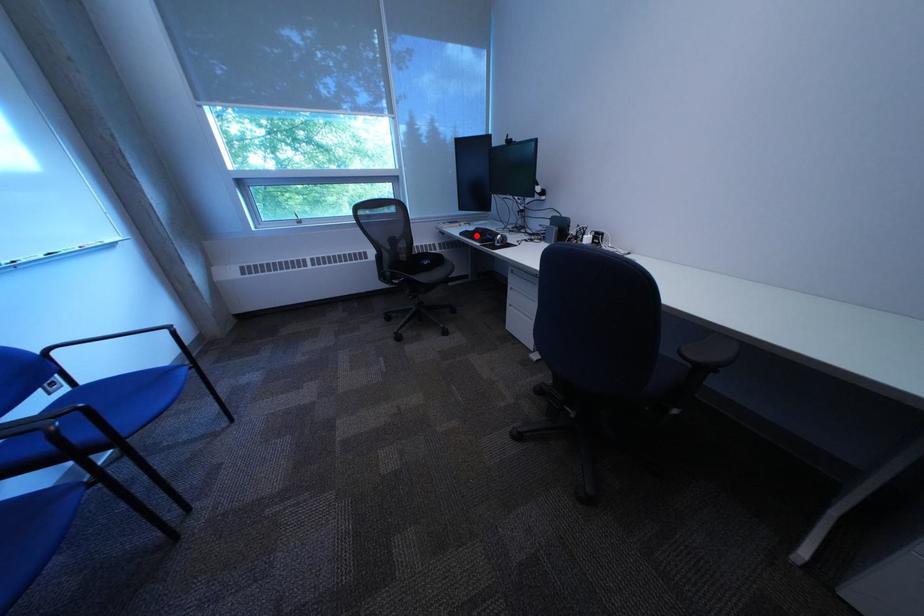
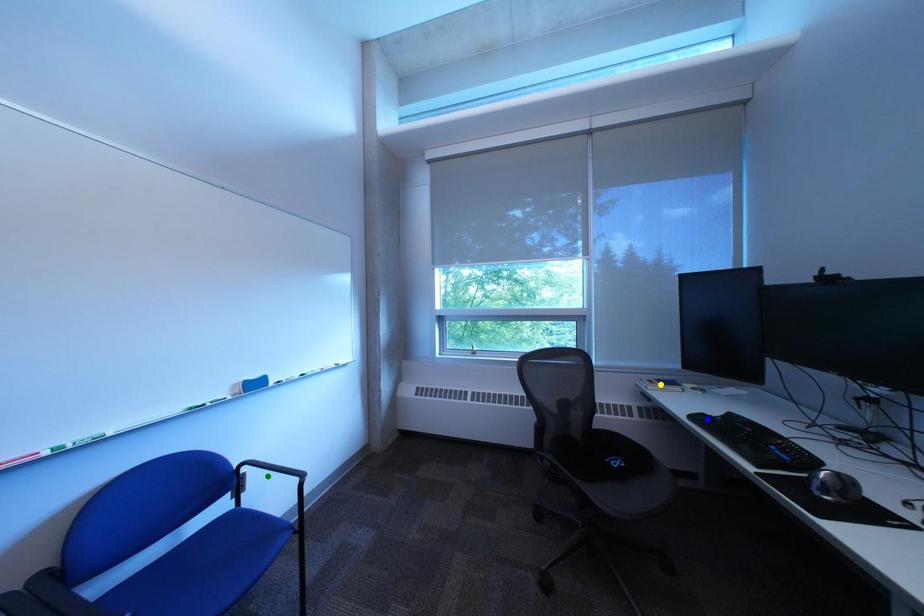
Question: I am providing you with two images of the same scene from different viewpoints. A red point is marked on the first image. You are given multiple points on the second image. Which spot in image 2 lines up with the point in image 1?

Choices:
 (A) yellow point
 (B) green point
 (C) blue point

Answer: (C)